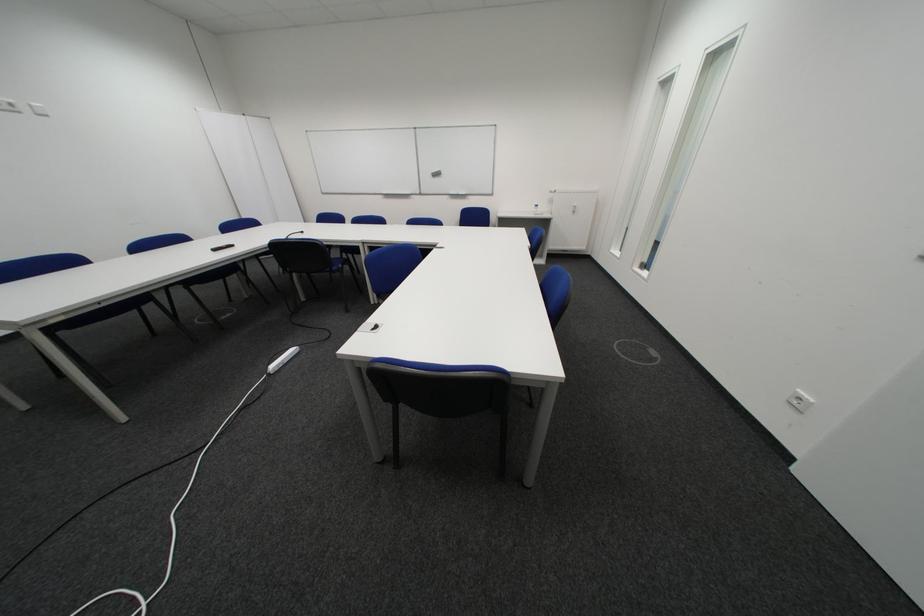
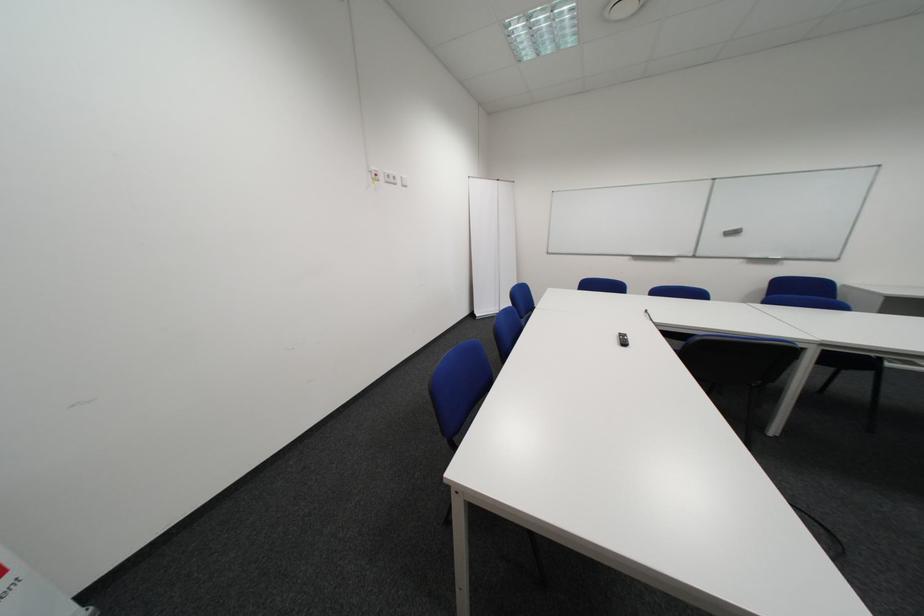
Question: What movement of the cameraman would produce the second image?

Choices:
 (A) Left
 (B) Right
 (C) Forward
 (D) Backward

Answer: (A)